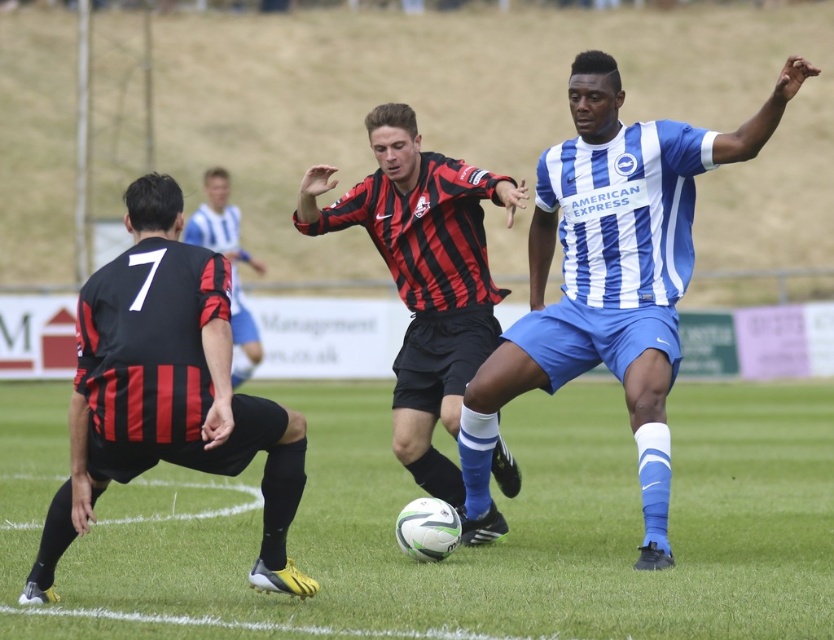
Question: Based on their relative distances, which object is nearer to the red and black striped jersey at center?

Choices:
 (A) green grass at center
 (B) black matte jersey at left
 (C) black striped jersey at center

Answer: (B)

Question: Is blue striped jersey at center above black matte jersey at left?

Choices:
 (A) no
 (B) yes

Answer: (B)

Question: Does green grass at center have a lesser width compared to red and black striped jersey at center?

Choices:
 (A) no
 (B) yes

Answer: (A)

Question: Which is farther from the black striped jersey at center?

Choices:
 (A) blue striped jersey at center
 (B) green grass at center

Answer: (A)

Question: Based on their relative distances, which object is nearer to the red and black striped jersey at center?

Choices:
 (A) black striped jersey at center
 (B) blue striped jersey at center
 (C) black matte jersey at left
 (D) green grass at center

Answer: (B)

Question: Is green grass at center further to the viewer compared to red and black striped jersey at center?

Choices:
 (A) yes
 (B) no

Answer: (B)